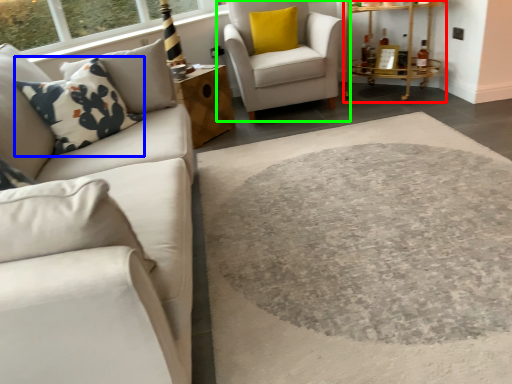
Question: Considering the real-world distances, which object is farthest from table (highlighted by a red box)? throw pillow (highlighted by a blue box) or chair (highlighted by a green box)?

Choices:
 (A) throw pillow
 (B) chair

Answer: (A)